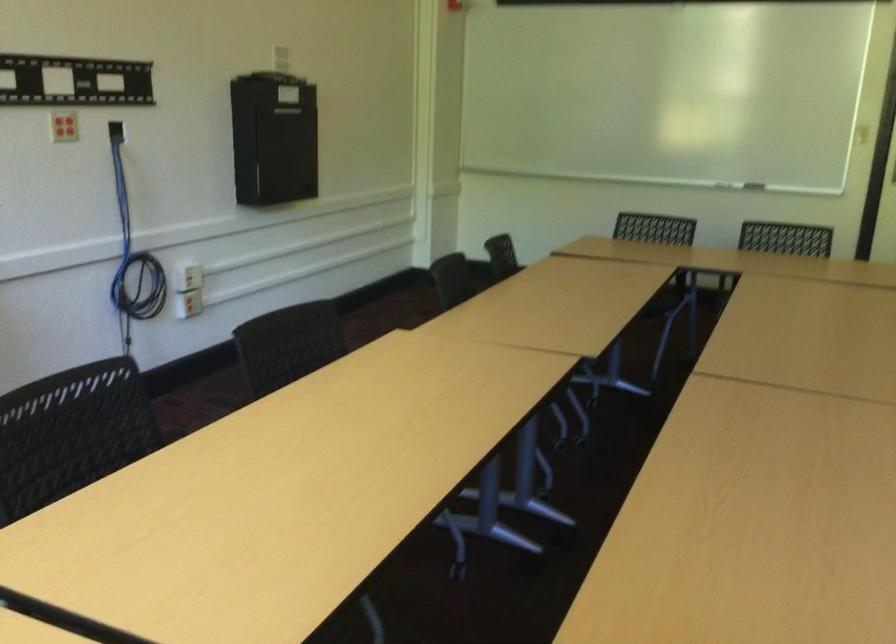
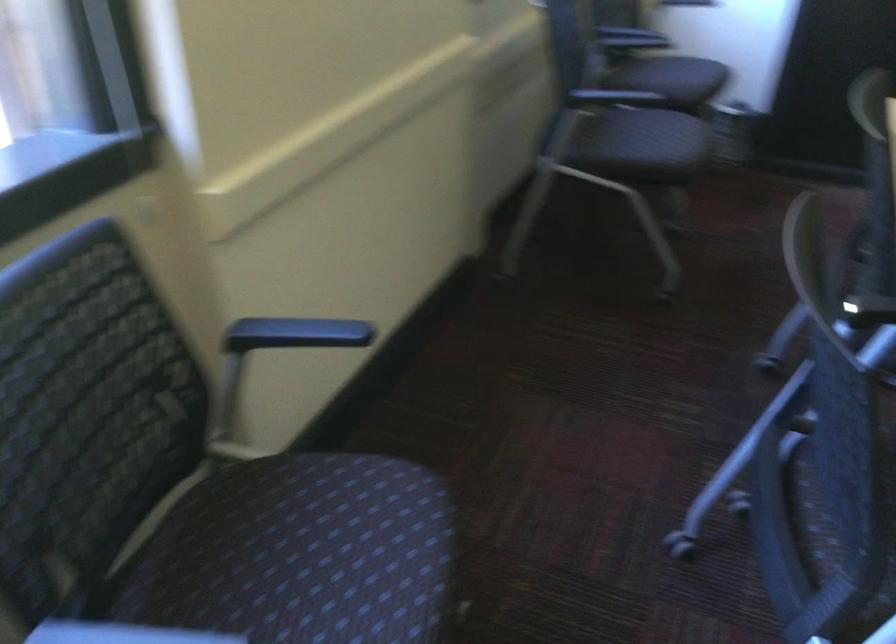
Based on the photo, based on the continuous images, in which direction is the camera rotating?

The camera rotated toward left-down.